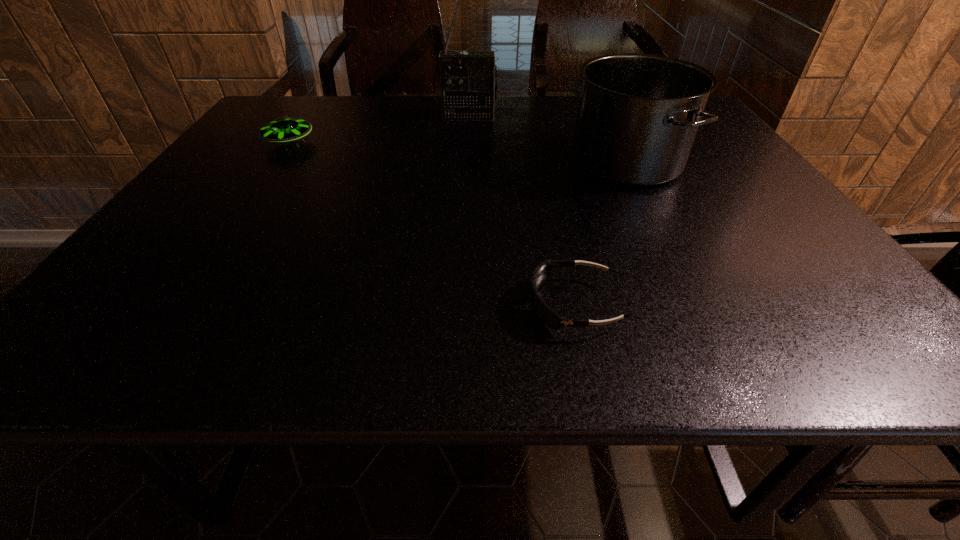
Where is `vacant region at the right edge`? This screenshot has width=960, height=540. vacant region at the right edge is located at coordinates (819, 306).

The width and height of the screenshot is (960, 540). What are the coordinates of `blank space at the far left corner` in the screenshot? It's located at (315, 102).

At what (x,y) coordinates should I click in order to perform the action: click on free region at the near right corner of the desktop. Please return your answer as a coordinate pair (x, y). Looking at the image, I should click on [x=905, y=357].

Image resolution: width=960 pixels, height=540 pixels. Find the location of `vacant area that lies between the saucepan and the nearest object`. vacant area that lies between the saucepan and the nearest object is located at coordinates (600, 233).

Locate an element on the screen. Image resolution: width=960 pixels, height=540 pixels. empty location between the tallest object and the third tallest object is located at coordinates (379, 130).

Find the location of a particular element. Image resolution: width=960 pixels, height=540 pixels. free point between the tallest object and the third tallest object is located at coordinates (379, 130).

Locate an element on the screen. The width and height of the screenshot is (960, 540). free spot between the goggles and the third shortest object is located at coordinates (600, 233).

Find the location of `free point between the saucepan and the shortest object`. free point between the saucepan and the shortest object is located at coordinates (600, 233).

Where is `unoccupied area between the saucer and the nearest object`? unoccupied area between the saucer and the nearest object is located at coordinates (432, 224).

Where is `free spot between the tallest object and the third shortest object`? free spot between the tallest object and the third shortest object is located at coordinates (547, 139).